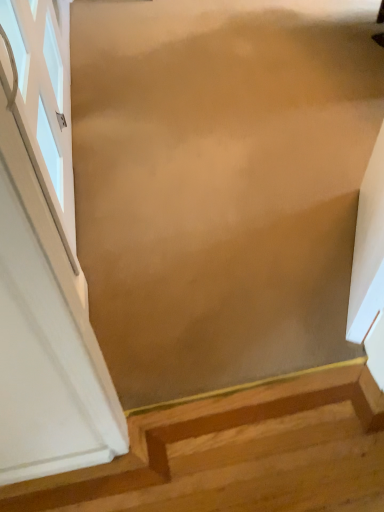
Question: Does point (44, 480) appear closer or farther from the camera than point (56, 123)?

Choices:
 (A) farther
 (B) closer

Answer: (B)

Question: Is wooden stairs at lower right taller or shorter than white glass window at left?

Choices:
 (A) tall
 (B) short

Answer: (B)

Question: Which is correct: wooden stairs at lower right is inside white glass window at left, or outside of it?

Choices:
 (A) inside
 (B) outside

Answer: (B)

Question: From the image's perspective, is white glass window at left above or below wooden stairs at lower right?

Choices:
 (A) above
 (B) below

Answer: (A)

Question: Considering their positions, is white glass window at left located in front of or behind wooden stairs at lower right?

Choices:
 (A) behind
 (B) front

Answer: (A)

Question: Does point (46, 48) appear closer or farther from the camera than point (9, 506)?

Choices:
 (A) farther
 (B) closer

Answer: (A)

Question: Based on their sizes in the image, would you say white glass window at left is bigger or smaller than wooden stairs at lower right?

Choices:
 (A) big
 (B) small

Answer: (B)